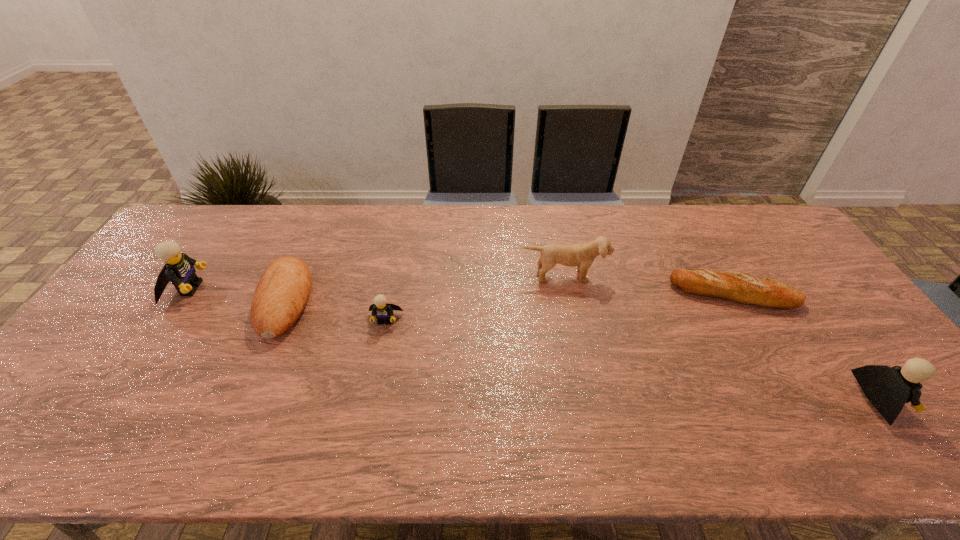
Image resolution: width=960 pixels, height=540 pixels. I want to click on free location located on the front-facing side of the second Lego from right to left, so click(x=374, y=375).

At what (x,y) coordinates should I click in order to perform the action: click on free space located on the back of the baguet. Please return your answer as a coordinate pair (x, y). Image resolution: width=960 pixels, height=540 pixels. Looking at the image, I should click on (695, 226).

Locate an element on the screen. The width and height of the screenshot is (960, 540). free point located 0.080m on the left side of the puppy is located at coordinates (569, 304).

This screenshot has width=960, height=540. I want to click on vacant space situated 0.180m on the back of the second object from left to right, so click(317, 230).

Image resolution: width=960 pixels, height=540 pixels. What are the coordinates of `object at the near edge` in the screenshot? It's located at (888, 388).

Identify the location of object that is at the left edge. Image resolution: width=960 pixels, height=540 pixels. (179, 269).

Find the location of a particular element. This screenshot has width=960, height=540. Lego at the right edge is located at coordinates (888, 388).

The image size is (960, 540). What are the coordinates of `baguet that is positioned at the right edge` in the screenshot? It's located at (739, 287).

Identify the location of object that is at the near right corner. Image resolution: width=960 pixels, height=540 pixels. (888, 388).

The width and height of the screenshot is (960, 540). Identify the location of vacant area at the far edge. (456, 230).